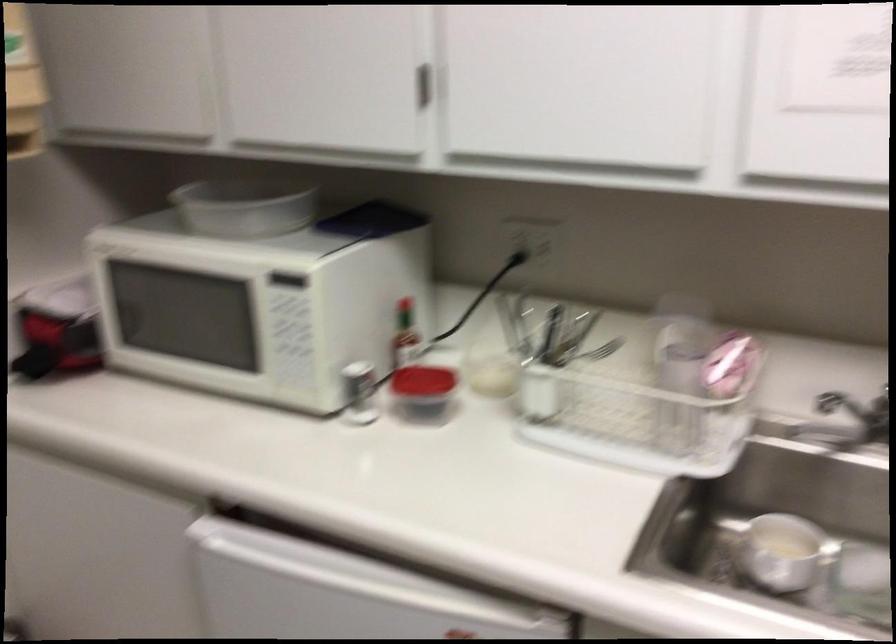
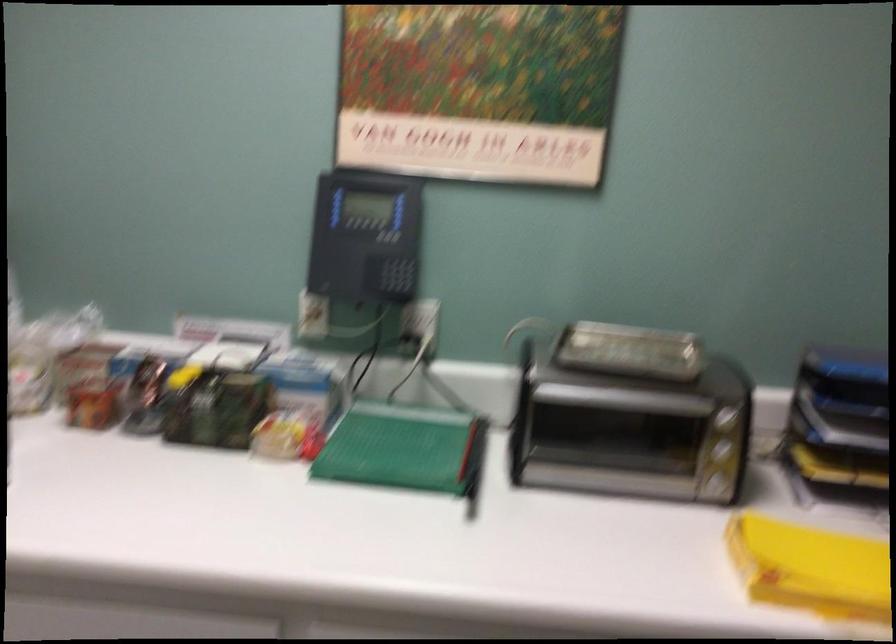
Based on the continuous images, in which direction is the camera rotating?

The camera's rotation is toward right-down.